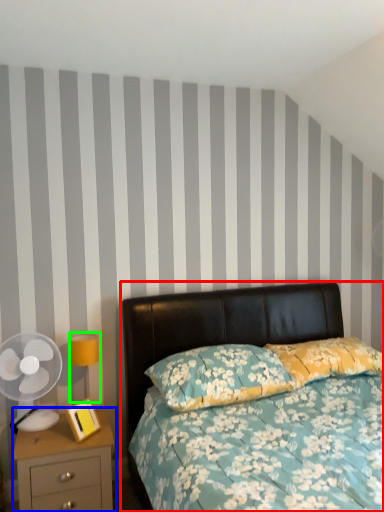
Question: Estimate the real-world distances between objects in this image. Which object is farther from bed (highlighted by a red box), nightstand (highlighted by a blue box) or bedside lamp (highlighted by a green box)?

Choices:
 (A) nightstand
 (B) bedside lamp

Answer: (A)